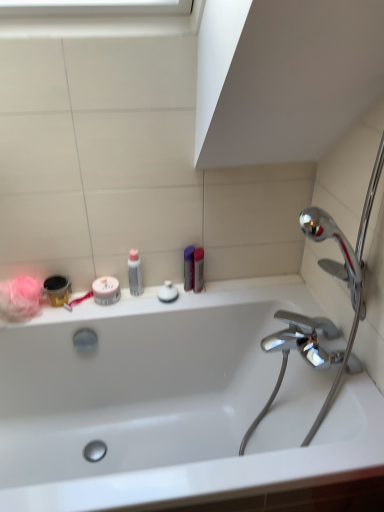
What are the coordinates of `spots to the right of metallic silver mouthwash at right, marked as the first mouthwash in a right-to-left arrangement` in the screenshot? It's located at (235, 290).